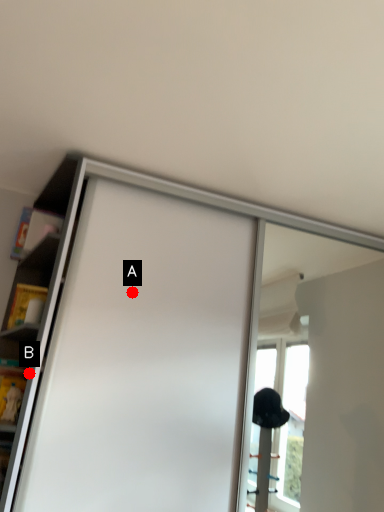
Question: Two points are circled on the image, labeled by A and B beside each circle. Which point is closer to the camera?

Choices:
 (A) A is closer
 (B) B is closer

Answer: (B)